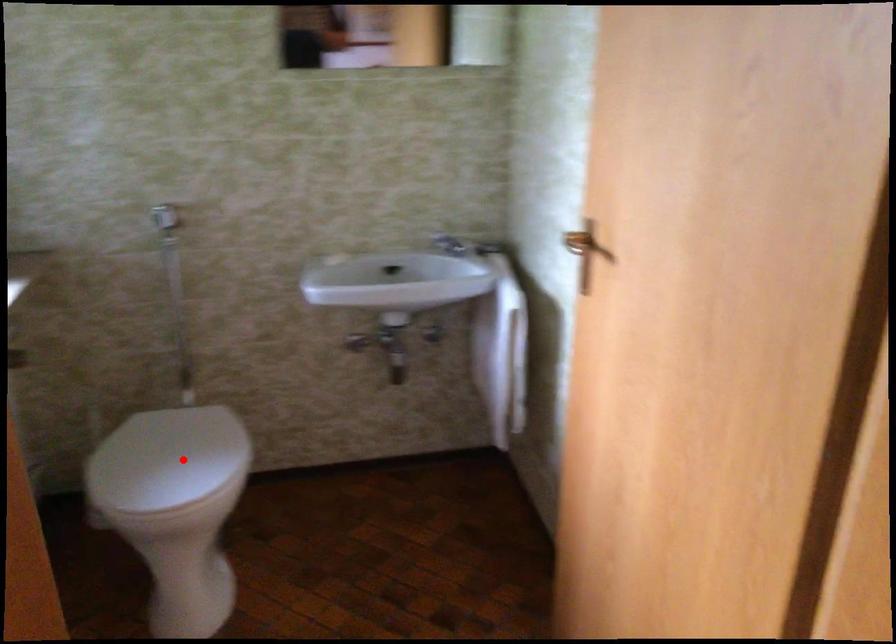
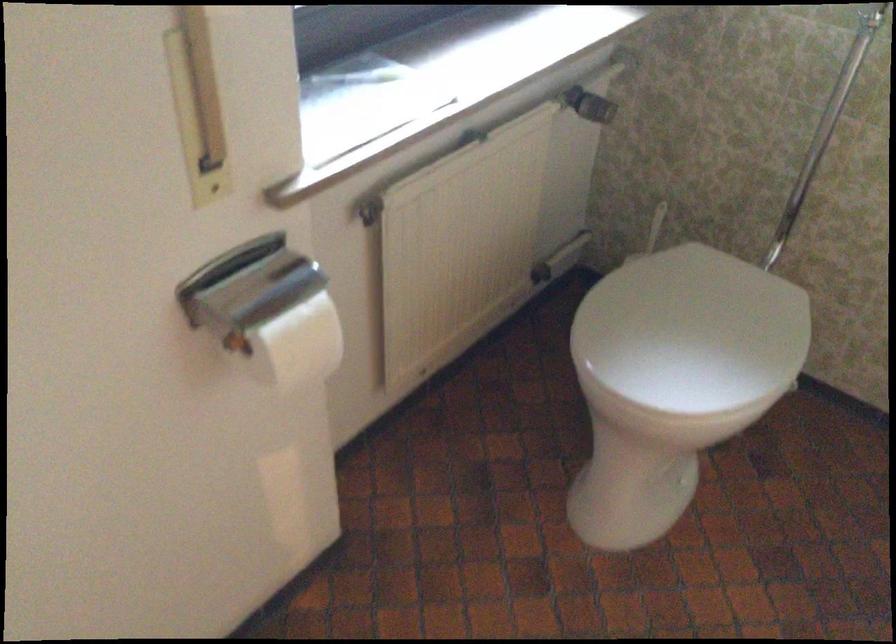
Where in the second image is the point corresponding to the highlighted location from the first image?

(692, 330)